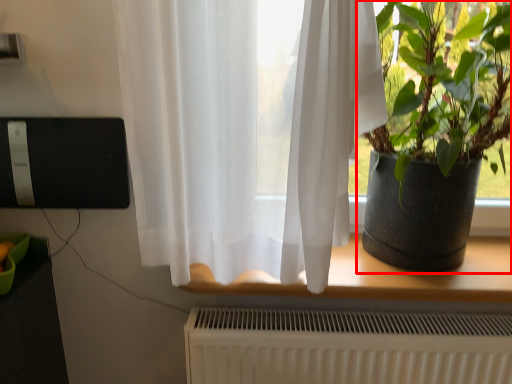
Question: In this image, where is houseplant (annotated by the red box) located relative to window?

Choices:
 (A) left
 (B) right

Answer: (B)